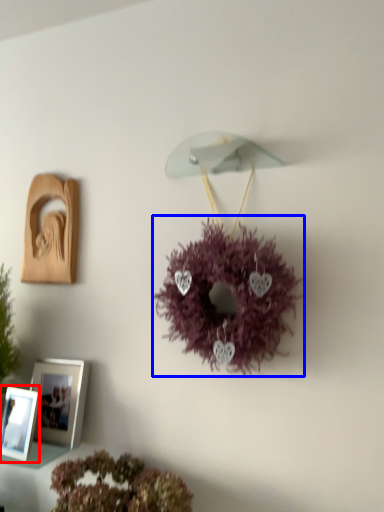
Question: Which point is further to the camera, picture frame (highlighted by a red box) or flower (highlighted by a blue box)?

Choices:
 (A) picture frame
 (B) flower

Answer: (A)